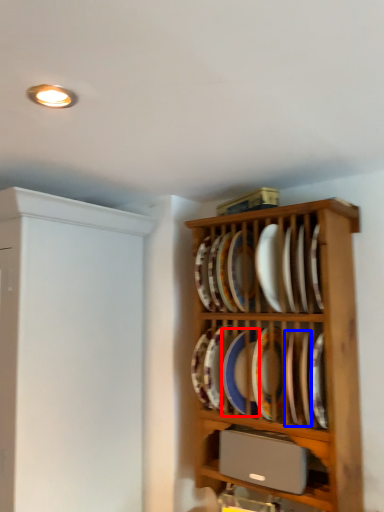
Question: Which point is closer to the camera, platter (highlighted by a red box) or platter (highlighted by a blue box)?

Choices:
 (A) platter
 (B) platter

Answer: (B)